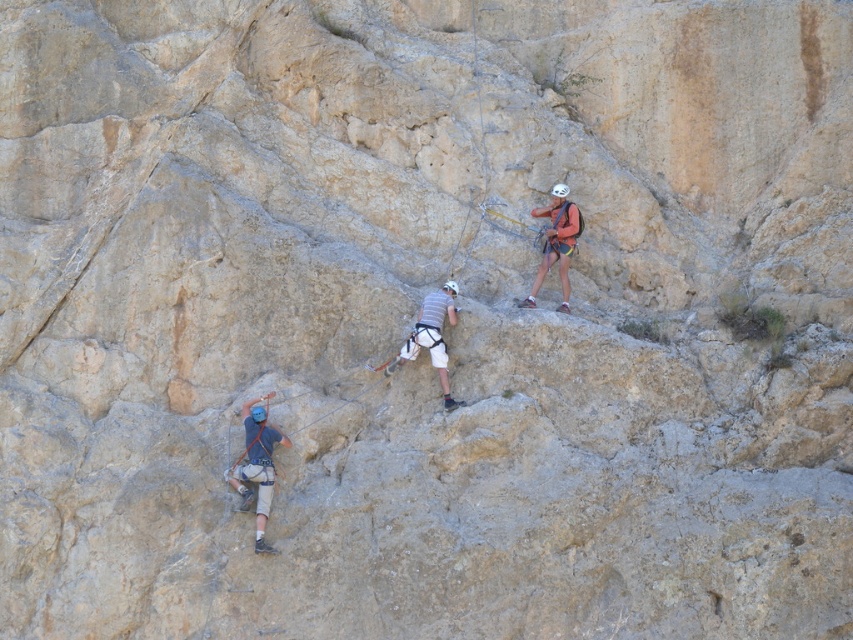
The width and height of the screenshot is (853, 640). Describe the element at coordinates (257, 467) in the screenshot. I see `blue matte climbing harness at lower left` at that location.

Between point (264, 484) and point (427, 305), which one is positioned in front?

Positioned in front is point (264, 484).

Find the location of a particular element. blue matte climbing harness at lower left is located at coordinates (257, 467).

Locate an element on the screen. The height and width of the screenshot is (640, 853). blue matte climbing harness at lower left is located at coordinates (x=257, y=467).

Is white matte climbing harness at center to the left of orange fabric harness at upper right from the viewer's perspective?

Correct, you'll find white matte climbing harness at center to the left of orange fabric harness at upper right.

Is point (409, 333) positioned in front of point (563, 227)?

Yes, point (409, 333) is closer to viewer.

Between point (428, 324) and point (561, 268), which one is positioned in front?

Positioned in front is point (428, 324).

You are a GUI agent. You are given a task and a screenshot of the screen. Output one action in this format:
    pyautogui.click(x=<x>, y=<y>)
    Task: Click on the white matte climbing harness at center
    Image resolution: width=853 pixels, height=640 pixels.
    Given the screenshot: What is the action you would take?
    pyautogui.click(x=431, y=337)

Image resolution: width=853 pixels, height=640 pixels. What do you see at coordinates (257, 467) in the screenshot? I see `blue matte climbing harness at lower left` at bounding box center [257, 467].

The image size is (853, 640). What do you see at coordinates (257, 467) in the screenshot?
I see `blue matte climbing harness at lower left` at bounding box center [257, 467].

Where is `blue matte climbing harness at lower left`? blue matte climbing harness at lower left is located at coordinates (257, 467).